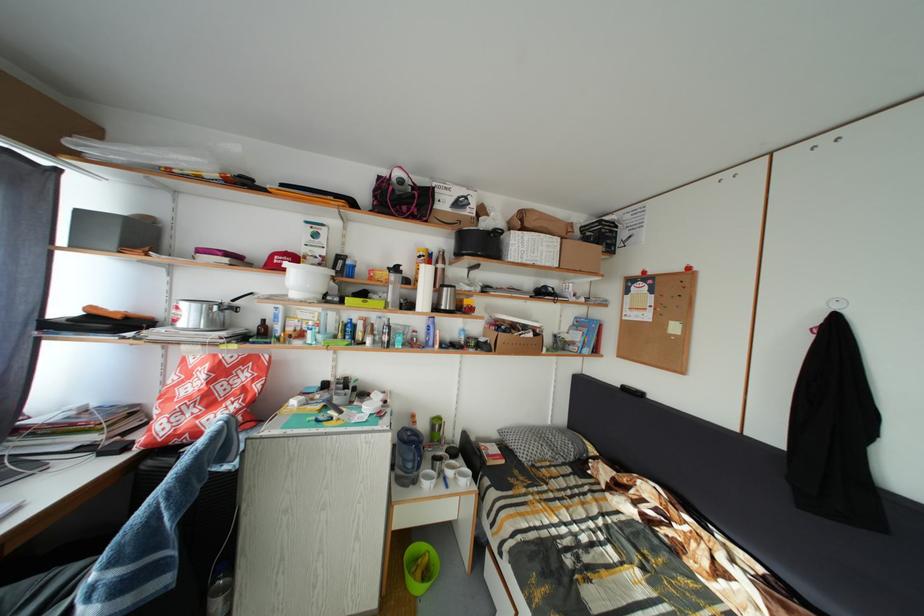
Locate an element on the screen. cardboard box is located at coordinates (514, 342).